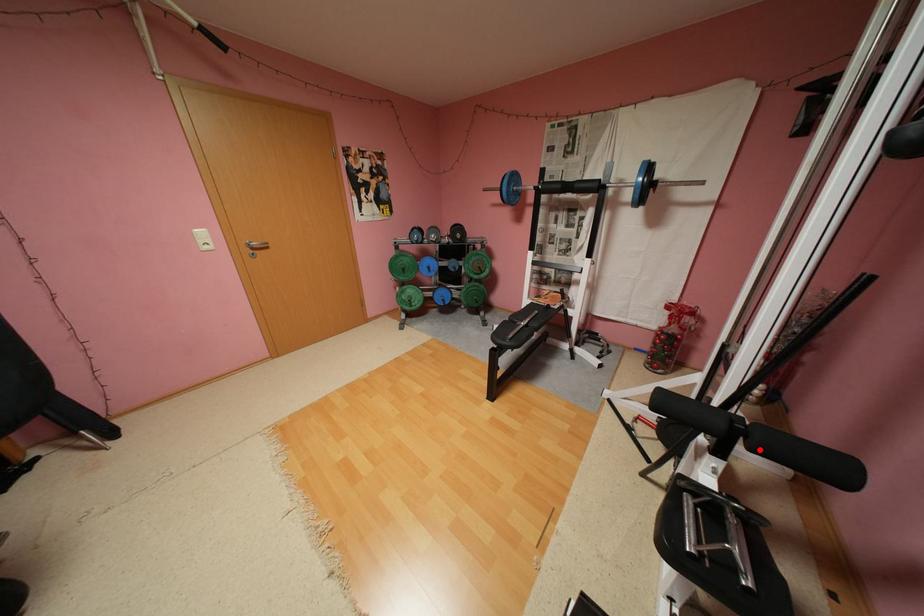
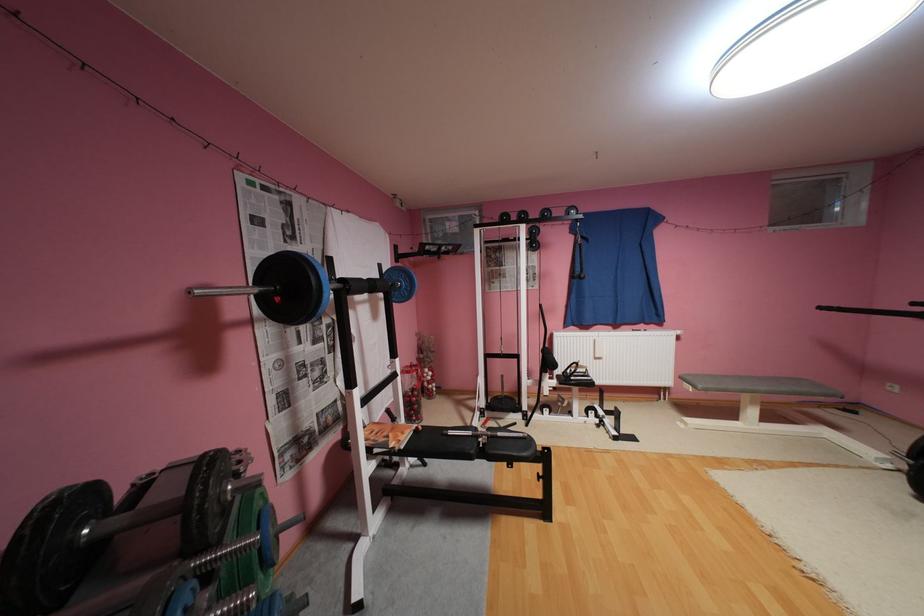
Question: I am providing you with two images of the same scene from different viewpoints. A red point is marked on the first image. Can you still see the location of the red point in image 2?

Choices:
 (A) Yes
 (B) No

Answer: (B)